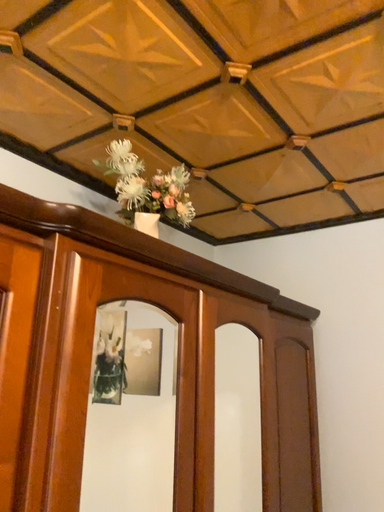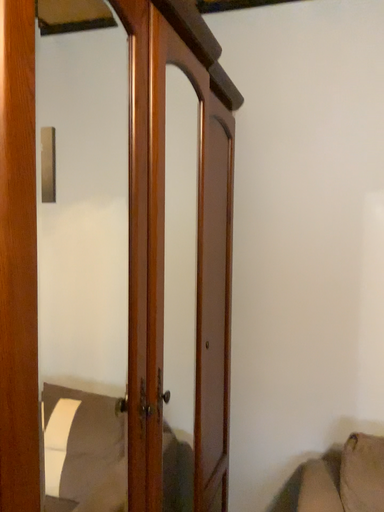
Question: Which way did the camera rotate in the video?

Choices:
 (A) rotated right
 (B) rotated left

Answer: (A)